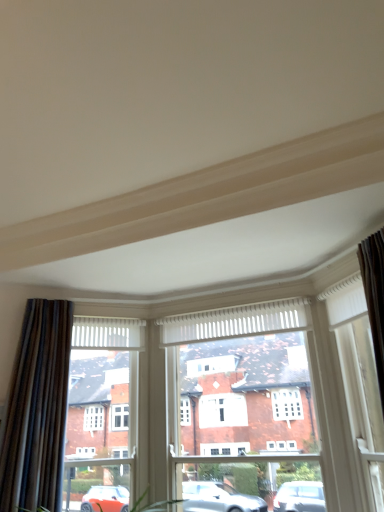
Question: Is the position of white wood frame at right less distant than that of white wood window frame at center?

Choices:
 (A) yes
 (B) no

Answer: (A)

Question: Is white wood frame at right far away from white wood window frame at center?

Choices:
 (A) no
 (B) yes

Answer: (A)

Question: Is white wood frame at right positioned beyond the bounds of white wood window frame at center?

Choices:
 (A) no
 (B) yes

Answer: (B)

Question: Is white wood frame at right at the left side of white wood window frame at center?

Choices:
 (A) yes
 (B) no

Answer: (B)

Question: Is white wood frame at right bigger than white wood window frame at center?

Choices:
 (A) no
 (B) yes

Answer: (A)

Question: Considering the positions of dark brown textured curtain at left and white wood frame at right in the image, is dark brown textured curtain at left taller or shorter than white wood frame at right?

Choices:
 (A) short
 (B) tall

Answer: (B)

Question: Is point (61, 479) positioned closer to the camera than point (372, 362)?

Choices:
 (A) closer
 (B) farther

Answer: (B)

Question: Is dark brown textured curtain at left in front of or behind white wood frame at right in the image?

Choices:
 (A) behind
 (B) front

Answer: (A)

Question: From a real-world perspective, relative to white wood frame at right, is dark brown textured curtain at left vertically above or below?

Choices:
 (A) below
 (B) above

Answer: (B)

Question: Looking at the image, does white wood frame at right seem bigger or smaller compared to white wood window frame at center?

Choices:
 (A) small
 (B) big

Answer: (A)

Question: Is white wood frame at right wider or thinner than white wood window frame at center?

Choices:
 (A) thin
 (B) wide

Answer: (A)

Question: From a real-world perspective, is white wood frame at right positioned above or below white wood window frame at center?

Choices:
 (A) below
 (B) above

Answer: (B)

Question: In terms of height, does white wood frame at right look taller or shorter compared to white wood window frame at center?

Choices:
 (A) tall
 (B) short

Answer: (B)

Question: Would you say white wood window frame at center is inside or outside white wood frame at right?

Choices:
 (A) inside
 (B) outside

Answer: (B)

Question: In terms of size, does white wood window frame at center appear bigger or smaller than white wood frame at right?

Choices:
 (A) big
 (B) small

Answer: (A)